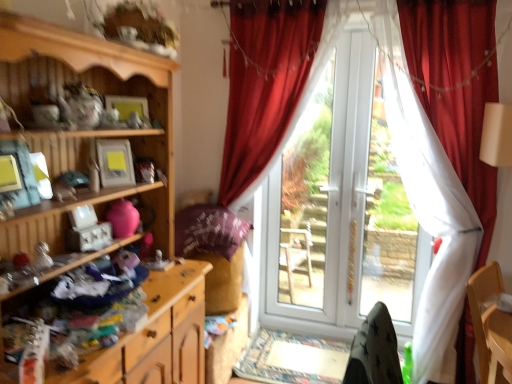
Question: Looking at the image, does wooden dresser at lower left, acting as the 1th cabinetry starting from the bottom, seem bigger or smaller compared to white glossy screen door at center?

Choices:
 (A) big
 (B) small

Answer: (B)

Question: Considering the positions of wooden dresser at lower left, acting as the 1th cabinetry starting from the bottom, and white glossy screen door at center in the image, is wooden dresser at lower left, acting as the 1th cabinetry starting from the bottom, wider or thinner than white glossy screen door at center?

Choices:
 (A) wide
 (B) thin

Answer: (A)

Question: Which object is the farthest from the white plastic door at center, arranged as the first bay window when viewed from the left?

Choices:
 (A) white plastic door at center, which is the 1th bay window in right-to-left order
 (B) wooden cabinet at left, which appears as the 1th cabinetry when viewed from the top
 (C) velvet red curtain at right, placed as the second curtain when sorted from left to right
 (D) wooden dresser at lower left, acting as the 1th cabinetry starting from the bottom
 (E) white glossy screen door at center

Answer: (D)

Question: Which object is positioned closest to the white plastic door at center, which appears as the second bay window when viewed from the left?

Choices:
 (A) wooden dresser at lower left, which ranks as the 2th cabinetry in top-to-bottom order
 (B) velvet red curtain at center, which ranks as the first curtain in left-to-right order
 (C) wooden cabinet at left, which appears as the 1th cabinetry when viewed from the top
 (D) velvet red curtain at right, the first curtain when ordered from right to left
 (E) white glossy screen door at center

Answer: (E)